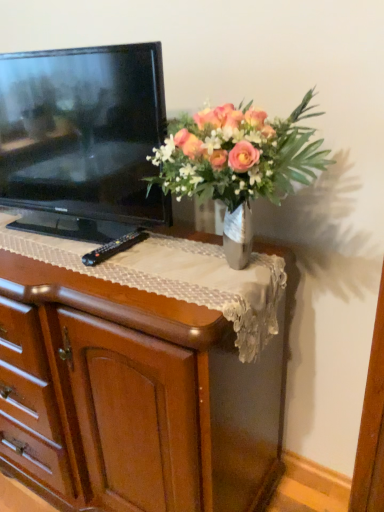
The width and height of the screenshot is (384, 512). Identify the location of free space to the left of black plastic remote at center. (53, 253).